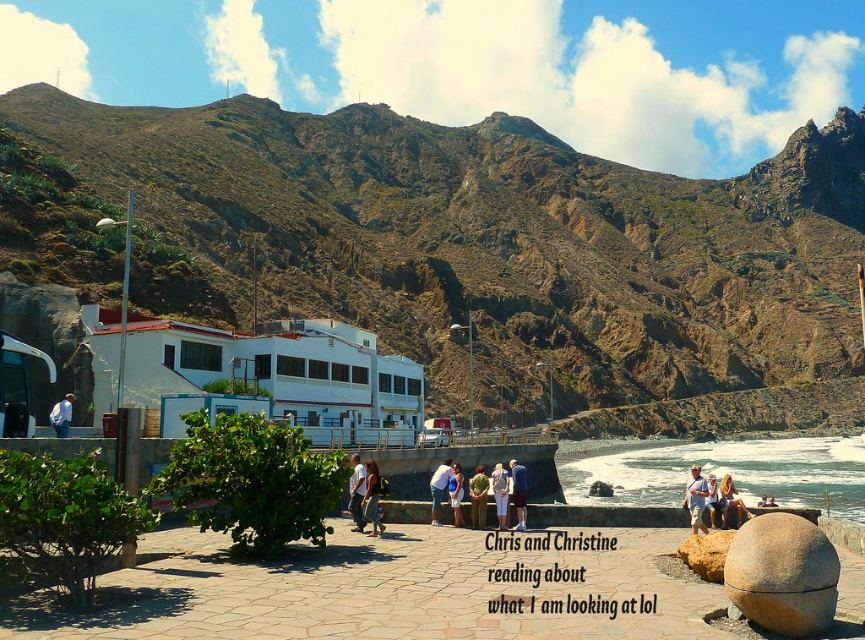
Consider the image. Which is more to the left, blue denim jeans at center or blue fabric shirt at center?

From the viewer's perspective, blue fabric shirt at center appears more on the left side.

What do you see at coordinates (519, 492) in the screenshot?
I see `blue denim jeans at center` at bounding box center [519, 492].

Which is in front, point (524, 508) or point (457, 474)?

Point (524, 508)

This screenshot has width=865, height=640. What are the coordinates of `blue denim jeans at center` in the screenshot? It's located at (519, 492).

Who is shorter, white matte building at center or denim shorts at center?

denim shorts at center

Which of these two, white matte building at center or denim shorts at center, stands taller?

white matte building at center is taller.

Is point (290, 404) farther from camera compared to point (364, 490)?

Yes, it is.

At what (x,y) coordinates should I click in order to perform the action: click on white matte building at center. Please return your answer as a coordinate pair (x, y). This screenshot has width=865, height=640. Looking at the image, I should click on (280, 376).

Does point (366, 481) lie behind point (432, 504)?

That is False.

Which is in front, point (375, 476) or point (439, 484)?

Point (375, 476)

Identify the location of denim shorts at center. This screenshot has height=640, width=865. (372, 499).